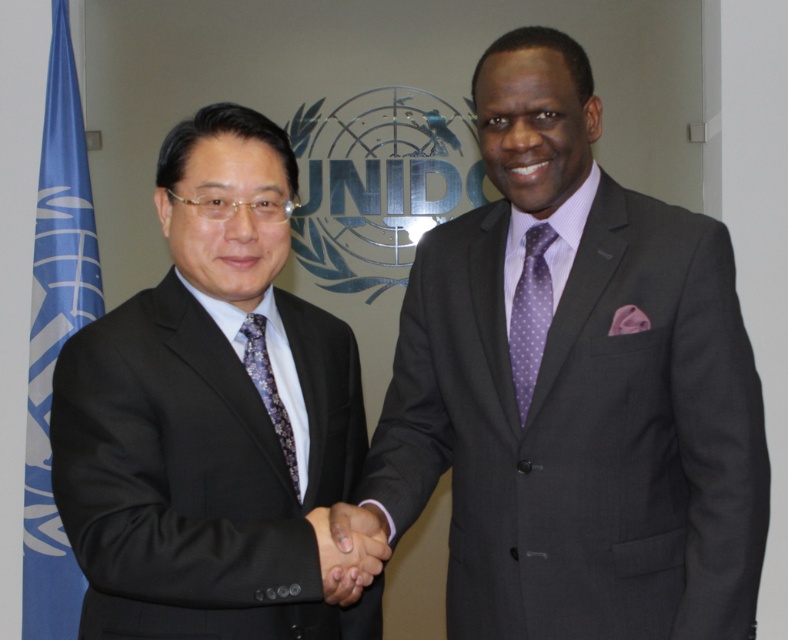
Is blue fabric flag at left smaller than black satin hand at center?

No, blue fabric flag at left is not smaller than black satin hand at center.

Is blue fabric flag at left thinner than black satin hand at center?

Incorrect, blue fabric flag at left's width is not less than black satin hand at center's.

Is point (50, 317) behind point (352, 515)?

Yes.

At what (x,y) coordinates should I click in order to perform the action: click on blue fabric flag at left. Please return your answer as a coordinate pair (x, y). Looking at the image, I should click on (54, 333).

Which of these two, matte black suit at left or matte purple tie at center, stands shorter?

Standing shorter between the two is matte purple tie at center.

Which is in front, point (177, 323) or point (269, 417)?

Point (177, 323) is more forward.

This screenshot has width=788, height=640. What do you see at coordinates (210, 416) in the screenshot?
I see `matte black suit at left` at bounding box center [210, 416].

Image resolution: width=788 pixels, height=640 pixels. Find the location of `matte black suit at left`. matte black suit at left is located at coordinates [210, 416].

Does point (108, 403) lie in front of point (65, 22)?

Yes.

Between matte black suit at left and blue fabric flag at left, which one has more height?

With more height is blue fabric flag at left.

Measure the distance between point (283, 515) and camera.

A distance of 4.62 feet exists between point (283, 515) and camera.

This screenshot has height=640, width=788. I want to click on matte black suit at left, so pyautogui.click(x=210, y=416).